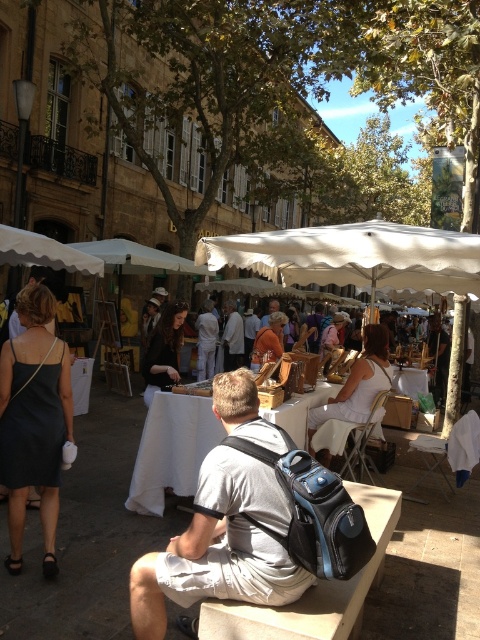
Question: Is wooden table at center positioned before light brown leather jacket at center?

Choices:
 (A) yes
 (B) no

Answer: (A)

Question: Which object is farther from the camera taking this photo?

Choices:
 (A) white cloth table at center
 (B) gray fabric backpack at center

Answer: (A)

Question: Which point is closer to the camera taking this photo?

Choices:
 (A) (384, 634)
 (B) (227, 340)
 (C) (160, 468)
 (D) (227, 426)

Answer: (D)

Question: Can you confirm if wooden table at center is wider than white cloth table at center?

Choices:
 (A) yes
 (B) no

Answer: (A)

Question: Can you confirm if gray fabric backpack at center is positioned below white cloth table at center?

Choices:
 (A) no
 (B) yes

Answer: (A)

Question: Estimate the real-world distances between objects in this image. Which object is closer to the light brown leather jacket at center?

Choices:
 (A) gray fabric backpack at center
 (B) white cloth table at center

Answer: (B)